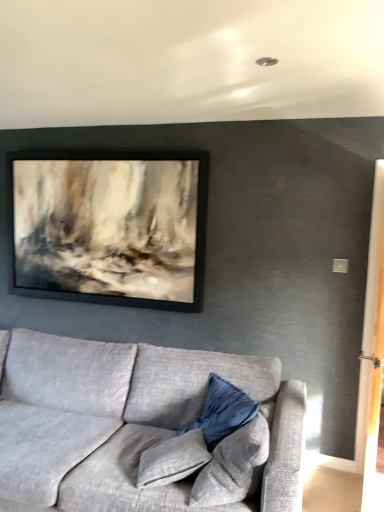
The image size is (384, 512). Identify the location of textured gray couch at lower left. (128, 422).

Measure the distance between point (238, 481) and camera.

Point (238, 481) and camera are 1.89 meters apart from each other.

Locate an element on the screen. This screenshot has width=384, height=512. textured gray couch at lower left is located at coordinates (128, 422).

At what (x,y) coordinates should I click in order to perform the action: click on the 1st pillow located above the textured gray couch at lower left (from a real-world perspective). Please return your answer as a coordinate pair (x, y). The image size is (384, 512). Looking at the image, I should click on (223, 411).

Between textured gray couch at lower left and velvet blue pillow at center, arranged as the 2th pillow when viewed from the front, which one has larger width?

With larger width is textured gray couch at lower left.

Is textured gray couch at lower left inside or outside of velvet blue pillow at center, arranged as the 2th pillow when viewed from the front?

textured gray couch at lower left is not inside velvet blue pillow at center, arranged as the 2th pillow when viewed from the front, it's outside.

From a real-world perspective, is textured gray couch at lower left on velvet blue pillow at center, placed as the 1th pillow when sorted from back to front?

Incorrect, from a real-world perspective, textured gray couch at lower left is lower than velvet blue pillow at center, placed as the 1th pillow when sorted from back to front.

Is textured gray couch at lower left not close to velvet blue pillow at lower center, the 2th pillow viewed from the back?

No, there isn't a large distance between textured gray couch at lower left and velvet blue pillow at lower center, the 2th pillow viewed from the back.

Is textured gray couch at lower left facing towards velvet blue pillow at lower center, the 2th pillow viewed from the back?

Yes.

Is velvet blue pillow at lower center, the 1th pillow in the front-to-back sequence, surrounded by textured gray couch at lower left?

Yes, textured gray couch at lower left is surrounding velvet blue pillow at lower center, the 1th pillow in the front-to-back sequence.

Considering their positions, is velvet blue pillow at lower center, the 2th pillow viewed from the back, located in front of or behind velvet blue pillow at center, placed as the 1th pillow when sorted from back to front?

velvet blue pillow at lower center, the 2th pillow viewed from the back, is in front of velvet blue pillow at center, placed as the 1th pillow when sorted from back to front.

Is velvet blue pillow at lower center, the 1th pillow in the front-to-back sequence, at the left side of velvet blue pillow at center, arranged as the 2th pillow when viewed from the front?

Incorrect, velvet blue pillow at lower center, the 1th pillow in the front-to-back sequence, is not on the left side of velvet blue pillow at center, arranged as the 2th pillow when viewed from the front.

What's the angular difference between velvet blue pillow at lower center, the 2th pillow viewed from the back, and velvet blue pillow at center, placed as the 1th pillow when sorted from back to front,'s facing directions?

The facing directions of velvet blue pillow at lower center, the 2th pillow viewed from the back, and velvet blue pillow at center, placed as the 1th pillow when sorted from back to front, are 19.9 degrees apart.

Which is closer to the camera, (197, 504) or (204, 434)?

Clearly, point (197, 504) is closer to the camera than point (204, 434).

From a real-world perspective, is velvet blue pillow at lower center, the 1th pillow in the front-to-back sequence, physically above textured gray couch at lower left?

Correct, in the physical world, velvet blue pillow at lower center, the 1th pillow in the front-to-back sequence, is higher than textured gray couch at lower left.

Consider the image. Considering the relative positions of velvet blue pillow at lower center, the 2th pillow viewed from the back, and textured gray couch at lower left in the image provided, is velvet blue pillow at lower center, the 2th pillow viewed from the back, to the left of textured gray couch at lower left from the viewer's perspective?

In fact, velvet blue pillow at lower center, the 2th pillow viewed from the back, is to the right of textured gray couch at lower left.

Is velvet blue pillow at lower center, the 1th pillow in the front-to-back sequence, oriented away from textured gray couch at lower left?

Yes, velvet blue pillow at lower center, the 1th pillow in the front-to-back sequence, is positioned with its back facing textured gray couch at lower left.

Who is bigger, velvet blue pillow at lower center, the 1th pillow in the front-to-back sequence, or textured gray couch at lower left?

textured gray couch at lower left.

Find the location of a particular element. The height and width of the screenshot is (512, 384). studio couch located on the left of velvet blue pillow at center, placed as the 1th pillow when sorted from back to front is located at coordinates (128, 422).

Which object is closer to the camera taking this photo, velvet blue pillow at center, arranged as the 2th pillow when viewed from the front, or textured gray couch at lower left?

Positioned in front is textured gray couch at lower left.

Looking at their sizes, would you say velvet blue pillow at center, placed as the 1th pillow when sorted from back to front, is wider or thinner than textured gray couch at lower left?

Clearly, velvet blue pillow at center, placed as the 1th pillow when sorted from back to front, has less width compared to textured gray couch at lower left.

Do you think velvet blue pillow at center, placed as the 1th pillow when sorted from back to front, is within textured gray couch at lower left, or outside of it?

velvet blue pillow at center, placed as the 1th pillow when sorted from back to front, is contained in textured gray couch at lower left.

Between velvet blue pillow at center, arranged as the 2th pillow when viewed from the front, and velvet blue pillow at lower center, the 1th pillow in the front-to-back sequence, which one has smaller width?

velvet blue pillow at center, arranged as the 2th pillow when viewed from the front, is thinner.

From a real-world perspective, relative to velvet blue pillow at lower center, the 1th pillow in the front-to-back sequence, is velvet blue pillow at center, placed as the 1th pillow when sorted from back to front, vertically above or below?

velvet blue pillow at center, placed as the 1th pillow when sorted from back to front, is situated lower than velvet blue pillow at lower center, the 1th pillow in the front-to-back sequence, in the real world.

Consider the image. Considering the sizes of objects velvet blue pillow at center, arranged as the 2th pillow when viewed from the front, and velvet blue pillow at lower center, the 1th pillow in the front-to-back sequence, in the image provided, who is taller, velvet blue pillow at center, arranged as the 2th pillow when viewed from the front, or velvet blue pillow at lower center, the 1th pillow in the front-to-back sequence,?

With more height is velvet blue pillow at lower center, the 1th pillow in the front-to-back sequence.

Which pillow is the 2nd one when counting from the back of the textured gray couch at lower left? Please provide its 2D coordinates.

[(223, 411)]

I want to click on the 2nd pillow positioned above the textured gray couch at lower left (from a real-world perspective), so tap(235, 464).

Consider the image. Considering their positions, is velvet blue pillow at center, arranged as the 2th pillow when viewed from the front, positioned closer to textured gray couch at lower left than velvet blue pillow at lower center, the 1th pillow in the front-to-back sequence?

velvet blue pillow at center, arranged as the 2th pillow when viewed from the front, is closer to textured gray couch at lower left.

Based on their spatial positions, is velvet blue pillow at center, arranged as the 2th pillow when viewed from the front, or textured gray couch at lower left closer to velvet blue pillow at lower center, the 2th pillow viewed from the back?

velvet blue pillow at center, arranged as the 2th pillow when viewed from the front, lies closer to velvet blue pillow at lower center, the 2th pillow viewed from the back, than the other object.

When comparing their distances from velvet blue pillow at center, placed as the 1th pillow when sorted from back to front, does textured gray couch at lower left or velvet blue pillow at lower center, the 1th pillow in the front-to-back sequence, seem closer?

velvet blue pillow at lower center, the 1th pillow in the front-to-back sequence, is positioned closer to the anchor velvet blue pillow at center, placed as the 1th pillow when sorted from back to front.

From the image, which object appears to be farther from velvet blue pillow at lower center, the 2th pillow viewed from the back, textured gray couch at lower left or velvet blue pillow at center, placed as the 1th pillow when sorted from back to front?

The object further to velvet blue pillow at lower center, the 2th pillow viewed from the back, is textured gray couch at lower left.

Estimate the real-world distances between objects in this image. Which object is closer to velvet blue pillow at center, placed as the 1th pillow when sorted from back to front, velvet blue pillow at lower center, the 1th pillow in the front-to-back sequence, or textured gray couch at lower left?

velvet blue pillow at lower center, the 1th pillow in the front-to-back sequence, is closer to velvet blue pillow at center, placed as the 1th pillow when sorted from back to front.

Considering their positions, is velvet blue pillow at lower center, the 1th pillow in the front-to-back sequence, positioned closer to textured gray couch at lower left than velvet blue pillow at center, arranged as the 2th pillow when viewed from the front?

velvet blue pillow at center, arranged as the 2th pillow when viewed from the front, is positioned closer to the anchor textured gray couch at lower left.

The width and height of the screenshot is (384, 512). In order to click on pillow between textured gray couch at lower left and velvet blue pillow at lower center, the 1th pillow in the front-to-back sequence, from left to right in this screenshot , I will do `click(223, 411)`.